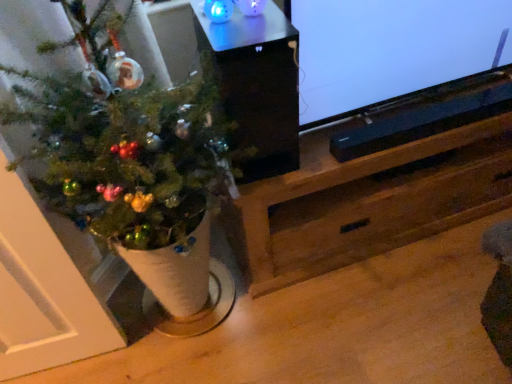
Question: Is the position of matte black speaker at upper right less distant than that of green matte christmas tree at left?

Choices:
 (A) yes
 (B) no

Answer: (B)

Question: Considering the relative sizes of matte black speaker at upper right and green matte christmas tree at left in the image provided, is matte black speaker at upper right taller than green matte christmas tree at left?

Choices:
 (A) yes
 (B) no

Answer: (B)

Question: Is matte black speaker at upper right thinner than green matte christmas tree at left?

Choices:
 (A) no
 (B) yes

Answer: (B)

Question: Is matte black speaker at upper right turned away from green matte christmas tree at left?

Choices:
 (A) yes
 (B) no

Answer: (B)

Question: Is matte black speaker at upper right smaller than green matte christmas tree at left?

Choices:
 (A) yes
 (B) no

Answer: (A)

Question: Does matte black speaker at upper right have a larger size compared to green matte christmas tree at left?

Choices:
 (A) no
 (B) yes

Answer: (A)

Question: Is black plastic soundbar at lower center positioned before black glossy speaker at upper center?

Choices:
 (A) no
 (B) yes

Answer: (A)

Question: Can you confirm if black plastic soundbar at lower center is positioned to the left of black glossy speaker at upper center?

Choices:
 (A) yes
 (B) no

Answer: (B)

Question: Could you tell me if black plastic soundbar at lower center is facing black glossy speaker at upper center?

Choices:
 (A) no
 (B) yes

Answer: (A)

Question: From the image's perspective, is black plastic soundbar at lower center located above black glossy speaker at upper center?

Choices:
 (A) no
 (B) yes

Answer: (A)

Question: Is black plastic soundbar at lower center thinner than black glossy speaker at upper center?

Choices:
 (A) no
 (B) yes

Answer: (B)

Question: Is black plastic soundbar at lower center facing away from black glossy speaker at upper center?

Choices:
 (A) no
 (B) yes

Answer: (A)

Question: Does black glossy speaker at upper center have a larger size compared to matte black speaker at upper right?

Choices:
 (A) yes
 (B) no

Answer: (B)